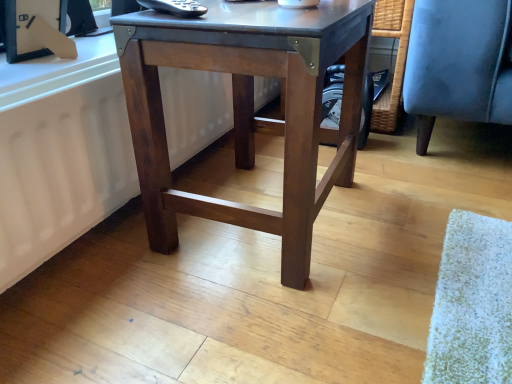
Identify the location of vacant space in dark brown wood table at center (from a real-world perspective). (252, 200).